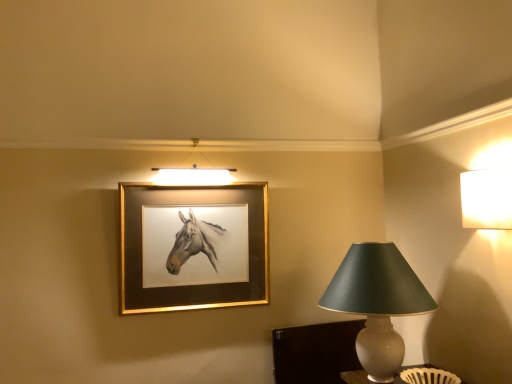
This screenshot has height=384, width=512. Find the location of `empty space that is ontop of gold metallic picture frame at upper center (from a real-world perspective)`. empty space that is ontop of gold metallic picture frame at upper center (from a real-world perspective) is located at coordinates (196, 182).